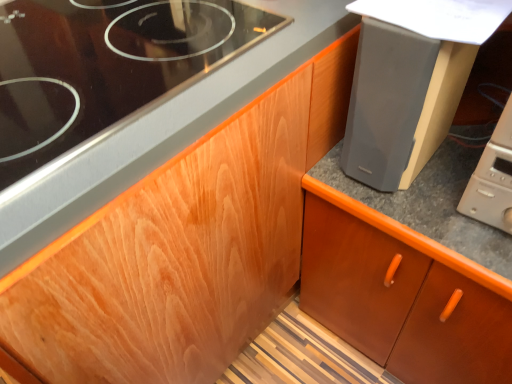
Find the location of a particular element. Image resolution: width=512 pixels, height=384 pixels. vacant space in front of matte gray speaker at upper right is located at coordinates (422, 213).